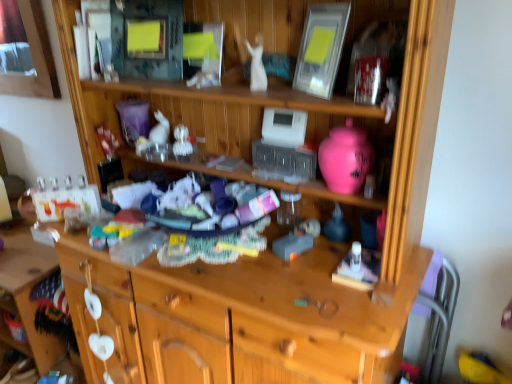
Question: Is pink glossy vase at upper right, which is counted as the fourth toy, starting from the left, to the left of matte silver picture frame at upper center from the viewer's perspective?

Choices:
 (A) yes
 (B) no

Answer: (B)

Question: Can you confirm if pink glossy vase at upper right, which is the fourth toy in back-to-front order, is wider than matte silver picture frame at upper center?

Choices:
 (A) yes
 (B) no

Answer: (A)

Question: Is pink glossy vase at upper right, which is counted as the fourth toy, starting from the left, thinner than matte silver picture frame at upper center?

Choices:
 (A) no
 (B) yes

Answer: (A)

Question: Is pink glossy vase at upper right, which is counted as the fourth toy, starting from the left, shorter than matte silver picture frame at upper center?

Choices:
 (A) yes
 (B) no

Answer: (A)

Question: Is matte silver picture frame at upper center at the back of pink glossy vase at upper right, the 1th toy when ordered from right to left?

Choices:
 (A) no
 (B) yes

Answer: (A)

Question: Considering the positions of point (441, 279) and point (305, 48), is point (441, 279) closer or farther from the camera than point (305, 48)?

Choices:
 (A) closer
 (B) farther

Answer: (B)

Question: Is purple fabric chair at right spatially inside matte silver picture frame at upper center, or outside of it?

Choices:
 (A) inside
 (B) outside

Answer: (B)

Question: From a real-world perspective, is purple fabric chair at right positioned above or below matte silver picture frame at upper center?

Choices:
 (A) above
 (B) below

Answer: (B)

Question: In terms of height, does purple fabric chair at right look taller or shorter compared to matte silver picture frame at upper center?

Choices:
 (A) tall
 (B) short

Answer: (A)

Question: In the image, is white matte rabbit at center, the 4th toy positioned from the right, positioned in front of or behind clear plastic ornaments at center, the third toy viewed from the front?

Choices:
 (A) behind
 (B) front

Answer: (A)

Question: Is white matte rabbit at center, which is the first toy in back-to-front order, inside or outside of clear plastic ornaments at center, the third toy viewed from the front?

Choices:
 (A) inside
 (B) outside

Answer: (B)

Question: In terms of height, does white matte rabbit at center, marked as the first toy in a left-to-right arrangement, look taller or shorter compared to clear plastic ornaments at center, arranged as the second toy when viewed from the left?

Choices:
 (A) short
 (B) tall

Answer: (B)

Question: From the image's perspective, is white matte rabbit at center, which ranks as the fourth toy in front-to-back order, positioned above or below clear plastic ornaments at center, the second toy when ordered from back to front?

Choices:
 (A) below
 (B) above

Answer: (B)

Question: Looking at the image, does matte silver picture frame at upper center seem bigger or smaller compared to white glossy statue at center, arranged as the 3th toy when viewed from the left?

Choices:
 (A) small
 (B) big

Answer: (B)

Question: Would you say matte silver picture frame at upper center is inside or outside white glossy statue at center, the 2th toy from the front?

Choices:
 (A) inside
 (B) outside

Answer: (B)